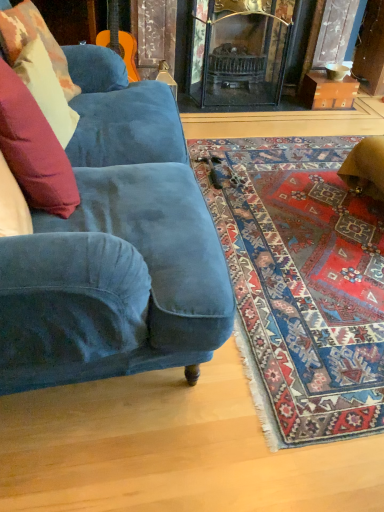
Identify the location of free space to the left of brown cardboard box at upper right. This screenshot has height=512, width=384. 287,102.